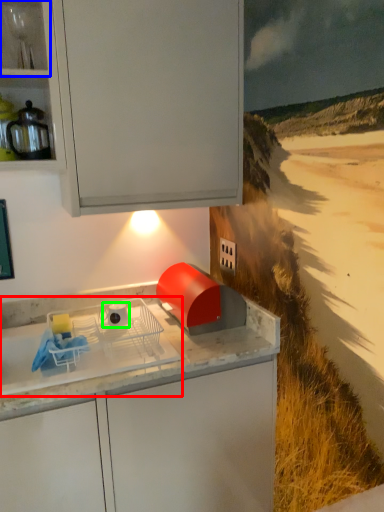
Question: Which object is the farthest from home appliance (highlighted by a red box)? Choose among these: shelf (highlighted by a blue box) or appliance (highlighted by a green box).

Choices:
 (A) shelf
 (B) appliance

Answer: (A)